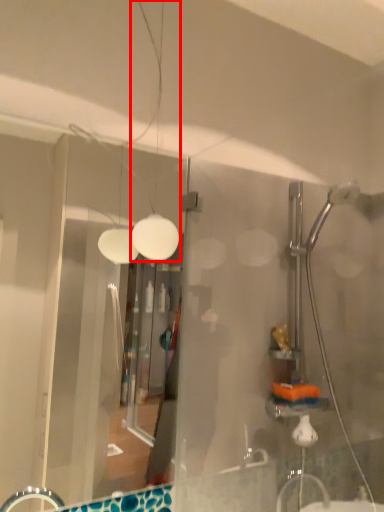
Question: From the image, what is the correct spatial relationship of light fixture (annotated by the red box) in relation to glass door?

Choices:
 (A) left
 (B) right

Answer: (B)